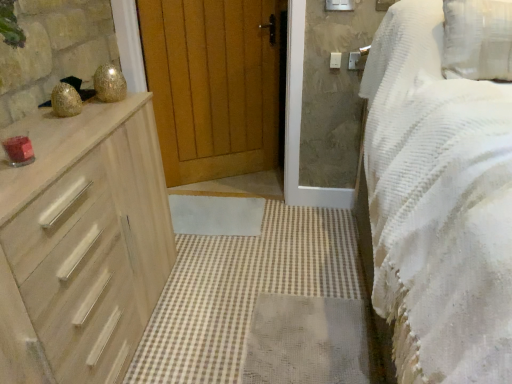
Question: Is wooden drawers at left placed right next to wooden at center?

Choices:
 (A) yes
 (B) no

Answer: (B)

Question: Is wooden drawers at left facing towards wooden at center?

Choices:
 (A) yes
 (B) no

Answer: (B)

Question: Can you confirm if wooden drawers at left is taller than wooden at center?

Choices:
 (A) no
 (B) yes

Answer: (A)

Question: Is wooden drawers at left closer to the viewer compared to wooden at center?

Choices:
 (A) yes
 (B) no

Answer: (A)

Question: Is wooden drawers at left turned away from wooden at center?

Choices:
 (A) no
 (B) yes

Answer: (B)

Question: From a real-world perspective, is wooden drawers at left beneath wooden at center?

Choices:
 (A) yes
 (B) no

Answer: (A)

Question: Does white plastic light switch at upper right turn towards wooden drawers at left?

Choices:
 (A) yes
 (B) no

Answer: (B)

Question: Considering the relative sizes of white plastic light switch at upper right and wooden drawers at left in the image provided, is white plastic light switch at upper right bigger than wooden drawers at left?

Choices:
 (A) yes
 (B) no

Answer: (B)

Question: Is white plastic light switch at upper right at the right side of wooden drawers at left?

Choices:
 (A) yes
 (B) no

Answer: (A)

Question: From the image's perspective, would you say white plastic light switch at upper right is positioned over wooden drawers at left?

Choices:
 (A) no
 (B) yes

Answer: (B)

Question: Would you say wooden drawers at left is part of white plastic light switch at upper right's contents?

Choices:
 (A) no
 (B) yes

Answer: (A)

Question: Are white plastic light switch at upper right and wooden drawers at left far apart?

Choices:
 (A) yes
 (B) no

Answer: (A)

Question: Is the depth of light wood chest of drawers at left less than that of white textured bed at right?

Choices:
 (A) yes
 (B) no

Answer: (B)